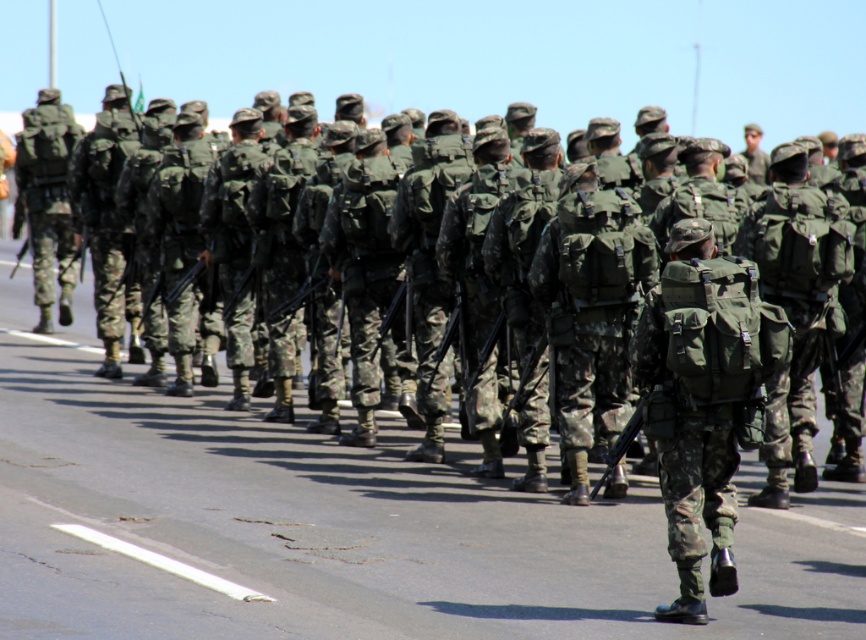
What are the coordinates of the camo fabric backpack at center?

The camo fabric backpack at center is located at point (x=703, y=401).

You are a drone operator trying to capture a close shot of the camouflage fabric backpack at center and the white asphalt at lower left. The drone has a minimum focus distance of 10 feet. Can the drone focus on both objects simultaneously?

The distance between the camouflage fabric backpack at center and the white asphalt at lower left is 8.93 feet, which is less than the drone minimum focus distance of 10 feet. Therefore, the drone cannot focus on both objects simultaneously.